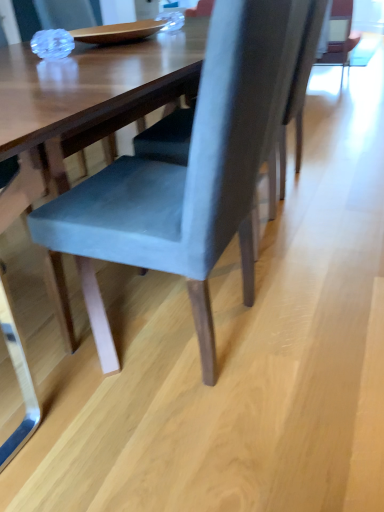
In order to click on free space to the right of velvet blue chair at center, the 2th chair from the back in this screenshot , I will do `click(312, 320)`.